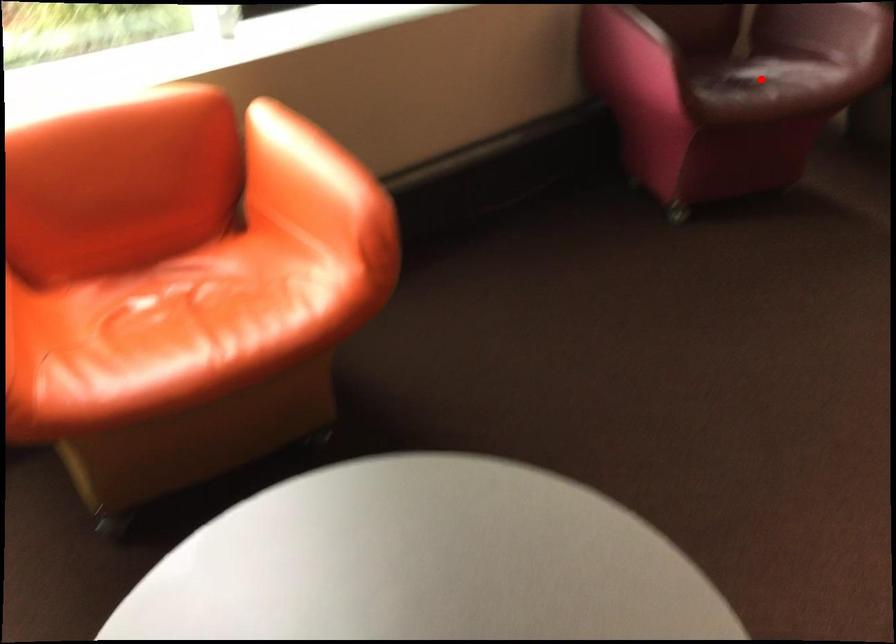
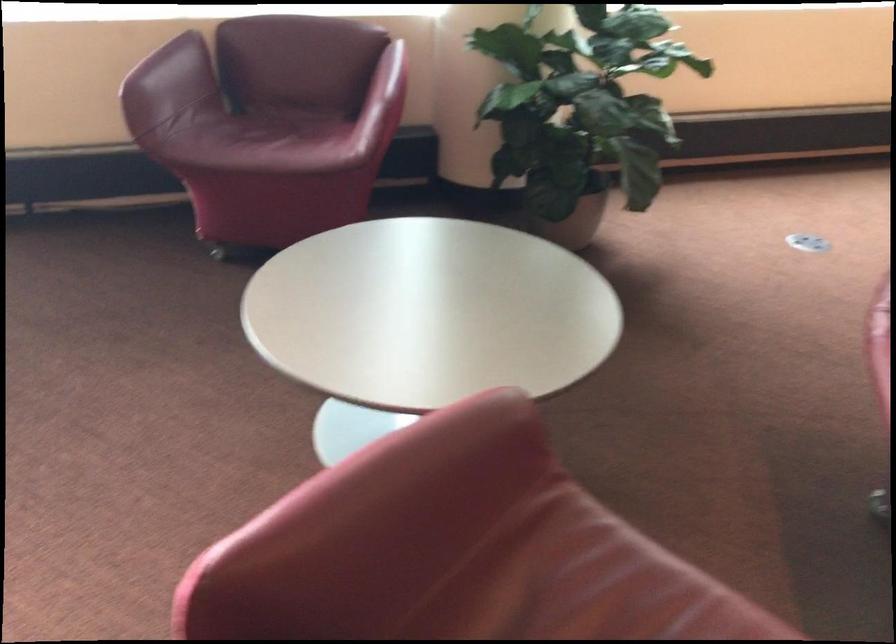
Where in the second image is the point corresponding to the highlighted location from the first image?

(263, 140)